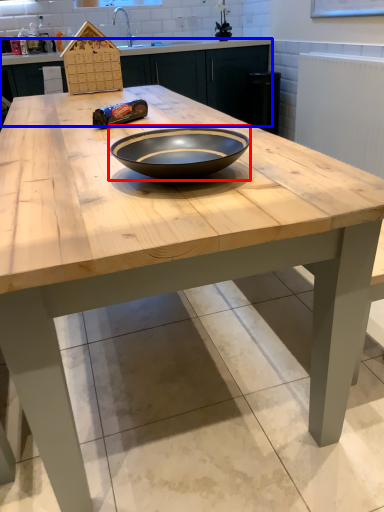
Question: Which of the following is the farthest to the observer, bowl (highlighted by a red box) or cabinetry (highlighted by a blue box)?

Choices:
 (A) bowl
 (B) cabinetry

Answer: (B)